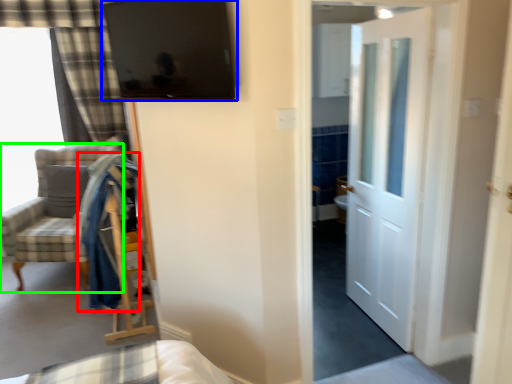
Question: Estimate the real-world distances between objects in this image. Which object is closer to robe (highlighted by a red box), window screen (highlighted by a blue box) or chair (highlighted by a green box)?

Choices:
 (A) window screen
 (B) chair

Answer: (B)